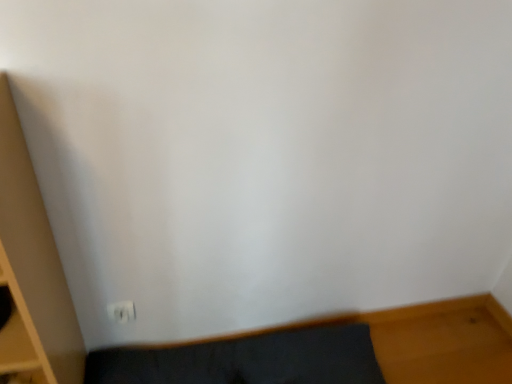
Question: In terms of width, does white plastic electric outlet at lower left look wider or thinner when compared to dark gray fabric rug at lower left?

Choices:
 (A) wide
 (B) thin

Answer: (B)

Question: Is white plastic electric outlet at lower left taller or shorter than dark gray fabric rug at lower left?

Choices:
 (A) short
 (B) tall

Answer: (A)

Question: Is white plastic electric outlet at lower left inside the boundaries of dark gray fabric rug at lower left, or outside?

Choices:
 (A) inside
 (B) outside

Answer: (B)

Question: Relative to white plastic electric outlet at lower left, is dark gray fabric rug at lower left in front or behind?

Choices:
 (A) behind
 (B) front

Answer: (B)

Question: Is point (128, 372) closer or farther from the camera than point (129, 311)?

Choices:
 (A) farther
 (B) closer

Answer: (A)

Question: From the image's perspective, is dark gray fabric rug at lower left positioned above or below white plastic electric outlet at lower left?

Choices:
 (A) above
 (B) below

Answer: (B)

Question: In terms of size, does dark gray fabric rug at lower left appear bigger or smaller than white plastic electric outlet at lower left?

Choices:
 (A) big
 (B) small

Answer: (A)